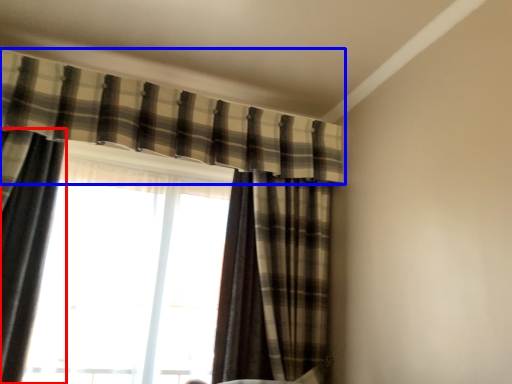
Question: Which object appears closest to the camera in this image, curtain (highlighted by a red box) or curtain (highlighted by a blue box)?

Choices:
 (A) curtain
 (B) curtain

Answer: (A)